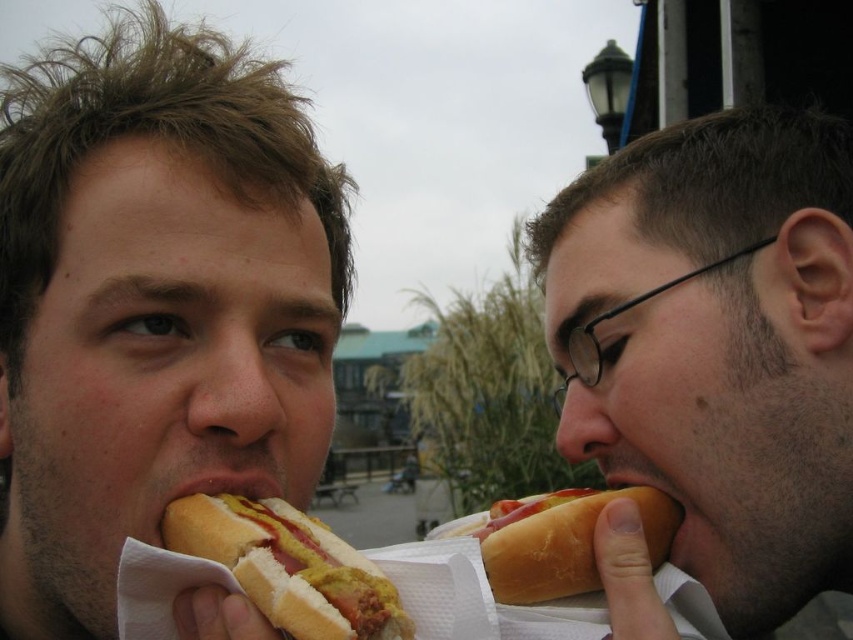
This screenshot has height=640, width=853. Identify the location of yellow mustard bun at center. (154, 301).

Is yellow mustard bun at center above matte brown hair at center?

Correct, yellow mustard bun at center is located above matte brown hair at center.

At what (x,y) coordinates should I click in order to perform the action: click on yellow mustard bun at center. Please return your answer as a coordinate pair (x, y). This screenshot has height=640, width=853. Looking at the image, I should click on (154, 301).

Can you confirm if yellow mustard bun at lower left is positioned above smooth skin mouth at lower right?

No.

Who is taller, yellow mustard bun at lower left or smooth skin mouth at lower right?

With more height is yellow mustard bun at lower left.

Where is `yellow mustard bun at lower left`? Image resolution: width=853 pixels, height=640 pixels. yellow mustard bun at lower left is located at coordinates (288, 566).

In the scene shown: Does matte brown hair at center have a lesser height compared to smooth skin mouth at lower right?

No.

What are the coordinates of `matte brown hair at center` in the screenshot? It's located at (717, 344).